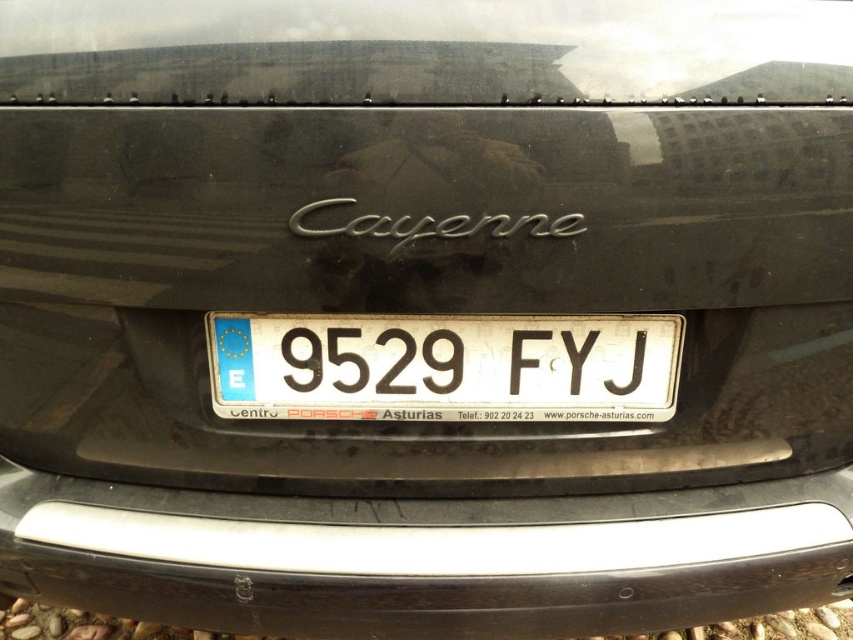
You are a delivery person trying to attach a package to the rear of the black Porsche Cayenne. You have two options for placement based on the objects present. The silver metallic bumper at center and the white plastic license plate at center. Which object is positioned lower and thus more suitable for attaching the package without blocking the license plate?

The silver metallic bumper at center is located below the white plastic license plate at center, so it is positioned lower and more suitable for attaching the package without blocking the license plate.

You are a delivery person trying to attach a package to the rear of the black Porsche Cayenne. The package requires a minimum of 10 inches of space to be safely secured. Given the distance between the silver metallic bumper at center and the white plastic license plate at center, is this possible?

The silver metallic bumper at center and white plastic license plate at center are 9.42 inches apart from each other. Since the required space is 10 inches, the package cannot be safely secured here as the available space is insufficient.

You are standing in front of a black Porsche Cayenne and want to locate the silver metallic bumper at center. According to the coordinates provided, where should you look on the car?

The silver metallic bumper at center is located at point coordinates (425,557) on the car.